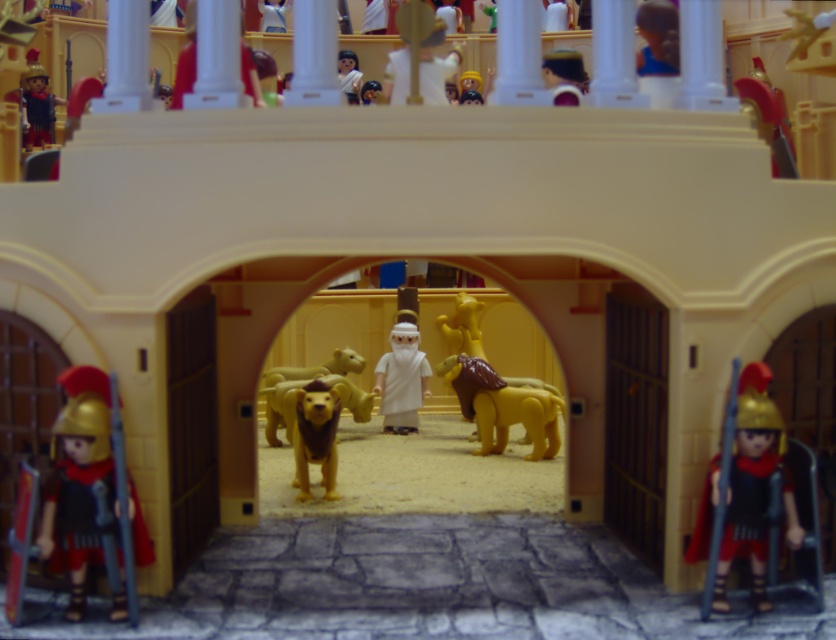
You are a visitor approaching the arena entrance and notice the white matte toga at center and the light brown plush lion at center. Which object appears wider from your perspective?

The light brown plush lion at center appears wider than the white matte toga at center because the white matte toga at center has a lesser width compared to light brown plush lion at center.

You are a visitor entering the arena and see the white matte toga at center and the yellow plush lion at center. Which object is smaller in size?

The white matte toga at center is smaller in size compared to the yellow plush lion at center.